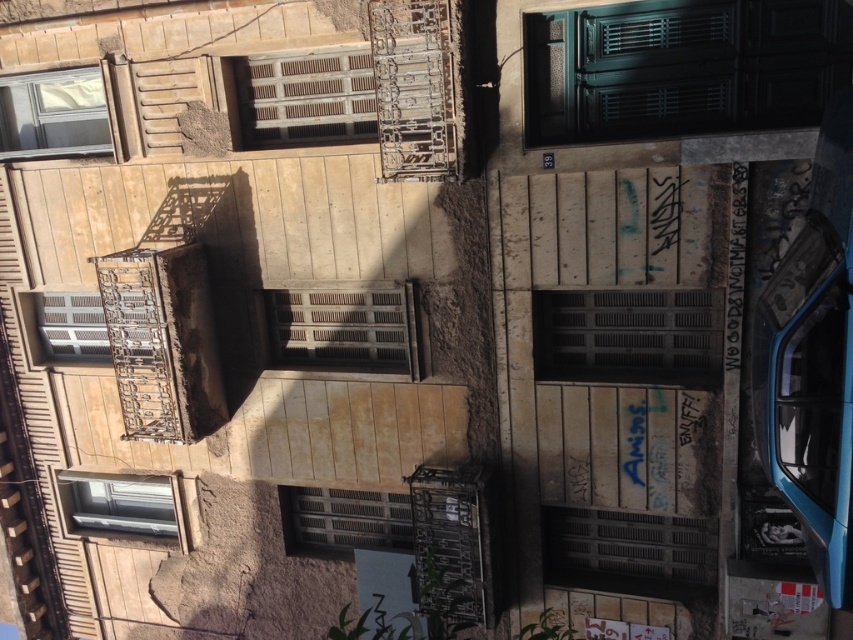
Between brown wooden shutter at center and wooden at center, which one is positioned lower?

brown wooden shutter at center is below.

Is brown wooden shutter at center smaller than wooden at center?

No, brown wooden shutter at center is not smaller than wooden at center.

Does point (589, 556) come farther from viewer compared to point (299, 516)?

No.

Find the location of a particular element. The width and height of the screenshot is (853, 640). brown wooden shutter at center is located at coordinates (628, 550).

Is point (41, 106) positioned after point (384, 532)?

Yes, it is behind point (384, 532).

Can you confirm if matte glass window at upper left is taller than wooden at center?

Indeed, matte glass window at upper left has a greater height compared to wooden at center.

This screenshot has width=853, height=640. I want to click on matte glass window at upper left, so click(x=53, y=115).

Who is taller, dark gray matte shutter at center or brown wooden shutter at center?

dark gray matte shutter at center

Measure the distance from dark gray matte shutter at center to brown wooden shutter at center.

A distance of 6.83 feet exists between dark gray matte shutter at center and brown wooden shutter at center.

Identify the location of dark gray matte shutter at center. (628, 336).